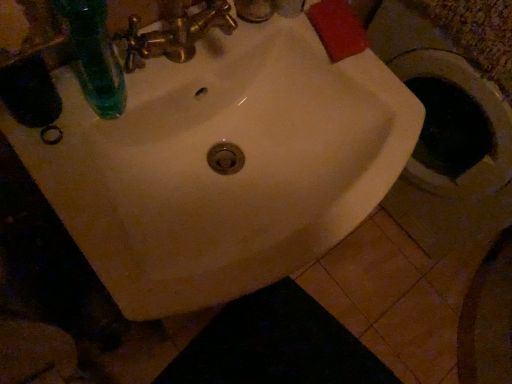
Question: Should I look upward or downward to see green glass bottle at upper left?

Choices:
 (A) up
 (B) down

Answer: (A)

Question: Is white glossy sink at center at the left side of green glass bottle at upper left?

Choices:
 (A) no
 (B) yes

Answer: (A)

Question: From a real-world perspective, is white glossy sink at center on top of green glass bottle at upper left?

Choices:
 (A) yes
 (B) no

Answer: (B)

Question: Is the surface of white glossy sink at center in direct contact with green glass bottle at upper left?

Choices:
 (A) no
 (B) yes

Answer: (A)

Question: Considering the relative sizes of white glossy sink at center and green glass bottle at upper left in the image provided, is white glossy sink at center shorter than green glass bottle at upper left?

Choices:
 (A) yes
 (B) no

Answer: (A)

Question: Is white glossy sink at center to the right of green glass bottle at upper left from the viewer's perspective?

Choices:
 (A) no
 (B) yes

Answer: (B)

Question: Does white glossy sink at center lie behind green glass bottle at upper left?

Choices:
 (A) yes
 (B) no

Answer: (A)

Question: Is white glossy sink at center completely or partially inside green glass bottle at upper left?

Choices:
 (A) no
 (B) yes

Answer: (A)

Question: Does green glass bottle at upper left have a smaller size compared to white glossy sink at center?

Choices:
 (A) yes
 (B) no

Answer: (A)

Question: Is green glass bottle at upper left completely or partially outside of white glossy sink at center?

Choices:
 (A) no
 (B) yes

Answer: (B)

Question: Could you tell me if green glass bottle at upper left is facing white glossy sink at center?

Choices:
 (A) no
 (B) yes

Answer: (A)

Question: Is green glass bottle at upper left positioned with its back to white glossy sink at center?

Choices:
 (A) yes
 (B) no

Answer: (B)

Question: From a real-world perspective, is green glass bottle at upper left below white glossy sink at center?

Choices:
 (A) no
 (B) yes

Answer: (A)

Question: Can you confirm if gold metallic faucet at upper center is shorter than green glass bottle at upper left?

Choices:
 (A) no
 (B) yes

Answer: (B)